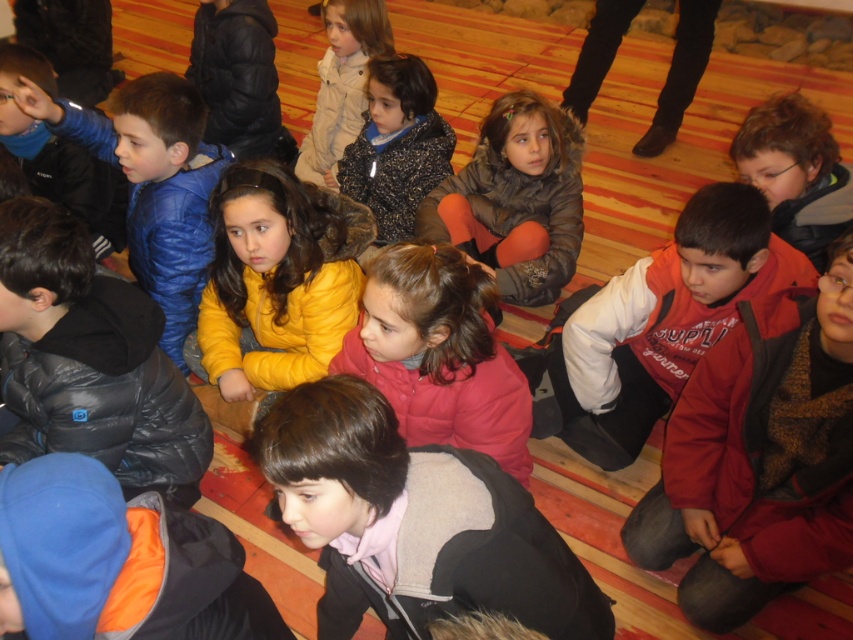
You are a photographer trying to capture a group photo of the children. You notice the red fleece jacket at center and the fluffy black coat at center. Which clothing item might you need to adjust in your composition to ensure both are clearly visible?

The red fleece jacket at center is larger in size than the fluffy black coat at center, so you might need to adjust the angle or position to accommodate the larger size of the red fleece jacket at center for clarity.

You are a photographer standing in front of the group of children. You want to take a clear photo of the brown fuzzy jacket at center without the red fleece jacket at lower right blocking it. How should you adjust your position?

Move your position further away from the red fleece jacket at lower right so that it is no longer in front of the brown fuzzy jacket at center.

You are a photographer trying to capture a group photo of the children. You notice the red fleece jacket at lower right and the brown fuzzy jacket at center. Which jacket would require more space to ensure it is fully visible in the photo?

The brown fuzzy jacket at center requires more space because its width is greater than the red fleece jacket at lower right.